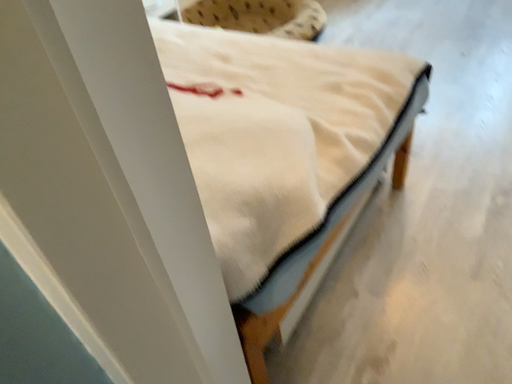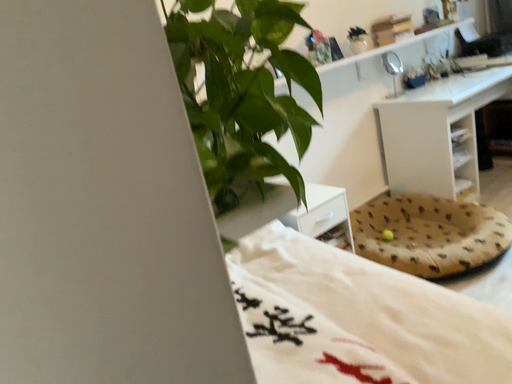
Question: How did the camera likely rotate when shooting the video?

Choices:
 (A) rotated right
 (B) rotated left

Answer: (B)